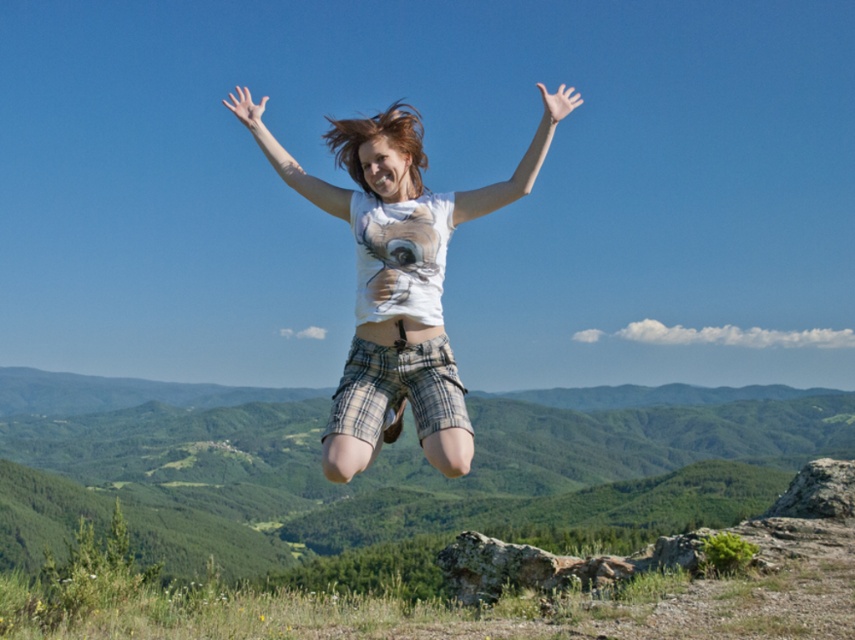
You are a photographer capturing the scene described. You notice a white matte arm at upper center located at point (519, 161). If you want to focus on this arm in your photo, which direction should you move your camera to center it in the frame?

The white matte arm at upper center is already at point (519, 161). To center it in the frame, move the camera slightly downward and to the right since the current coordinates are closer to the upper left quadrant of the image.

You are a photographer trying to capture the perfect shot of the jumping person in the scene. You notice two points marked in the image at coordinates point (547, 129) and point (246, 125). Which point is closer to your camera lens?

Point (547, 129) is closer to the camera than point (246, 125).

You are a photographer trying to capture the perfect shot of the person jumping. You notice a point marked at coordinates (398, 276) in the image. Based on the scene description, what object is located at that point?

The point at coordinates (398, 276) indicates the white cotton t shirt at center.